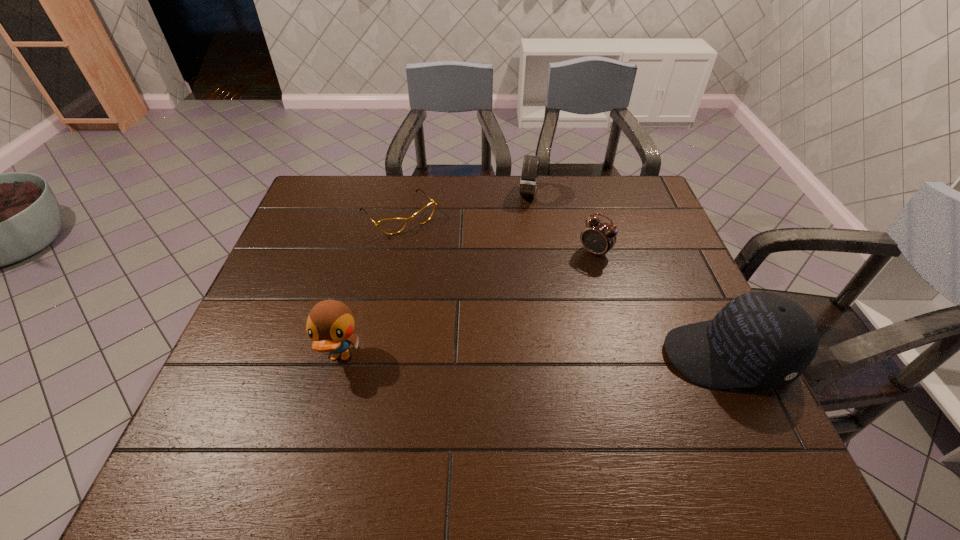
What are the coordinates of `object situated at the near edge` in the screenshot? It's located at (759, 339).

I want to click on object that is at the right edge, so click(x=759, y=339).

Where is `object at the near right corner`? Image resolution: width=960 pixels, height=540 pixels. object at the near right corner is located at coordinates (759, 339).

Identify the location of vacant space at the far edge of the desktop. Image resolution: width=960 pixels, height=540 pixels. (476, 201).

Locate an element on the screen. The height and width of the screenshot is (540, 960). free space at the near edge of the desktop is located at coordinates (583, 387).

This screenshot has height=540, width=960. In the image, there is a desktop. Identify the location of vacant space at the left edge. (251, 352).

This screenshot has width=960, height=540. Identify the location of blank area at the right edge. (653, 231).

Locate an element on the screen. The width and height of the screenshot is (960, 540). free region at the far left corner of the desktop is located at coordinates (325, 176).

Image resolution: width=960 pixels, height=540 pixels. What are the coordinates of `free point at the far right corner` in the screenshot? It's located at (653, 203).

Locate an element on the screen. This screenshot has height=540, width=960. vacant area between the duck and the third object from left to right is located at coordinates [434, 275].